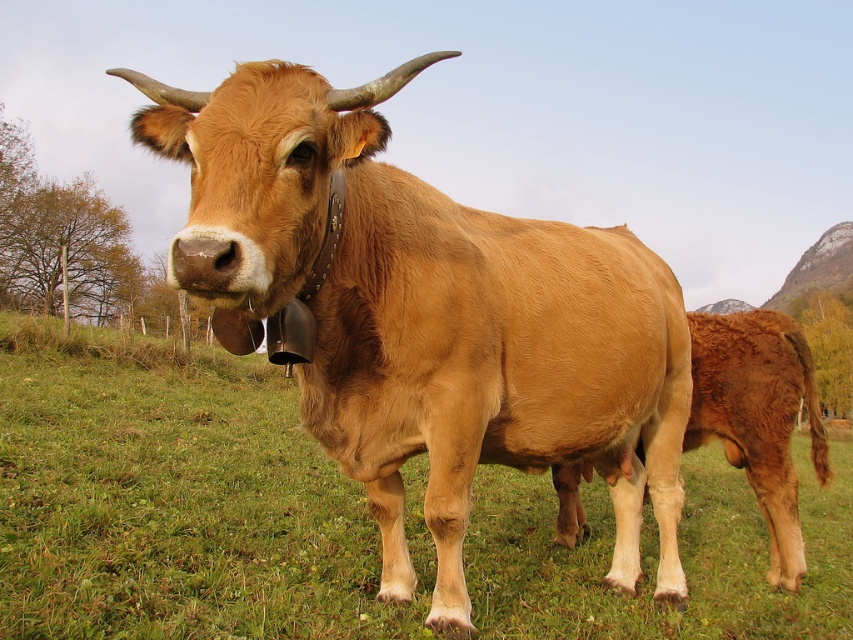
Question: Does green grass at center have a smaller size compared to brown smooth cow at lower right?

Choices:
 (A) yes
 (B) no

Answer: (B)

Question: Which of the following is the closest to the observer?

Choices:
 (A) green grass at center
 (B) brown smooth cow at lower right
 (C) shiny brown cow at center

Answer: (C)

Question: Is green grass at center bigger than shiny brown cow at center?

Choices:
 (A) yes
 (B) no

Answer: (A)

Question: Which object appears closest to the camera in this image?

Choices:
 (A) green grass at center
 (B) shiny brown cow at center
 (C) brown smooth cow at lower right

Answer: (B)

Question: Is green grass at center wider than shiny brown cow at center?

Choices:
 (A) yes
 (B) no

Answer: (A)

Question: Estimate the real-world distances between objects in this image. Which object is closer to the green grass at center?

Choices:
 (A) shiny brown cow at center
 (B) brown smooth cow at lower right

Answer: (A)